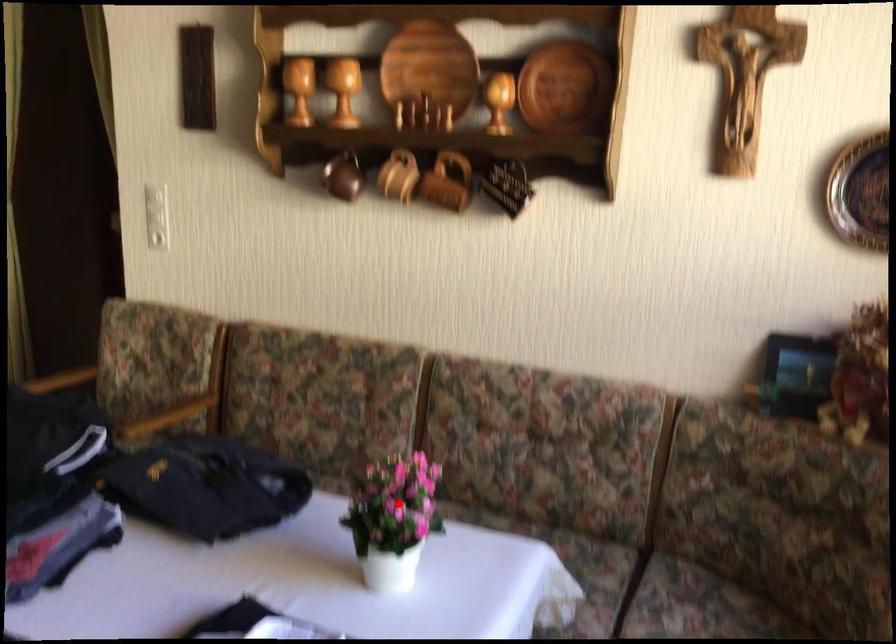
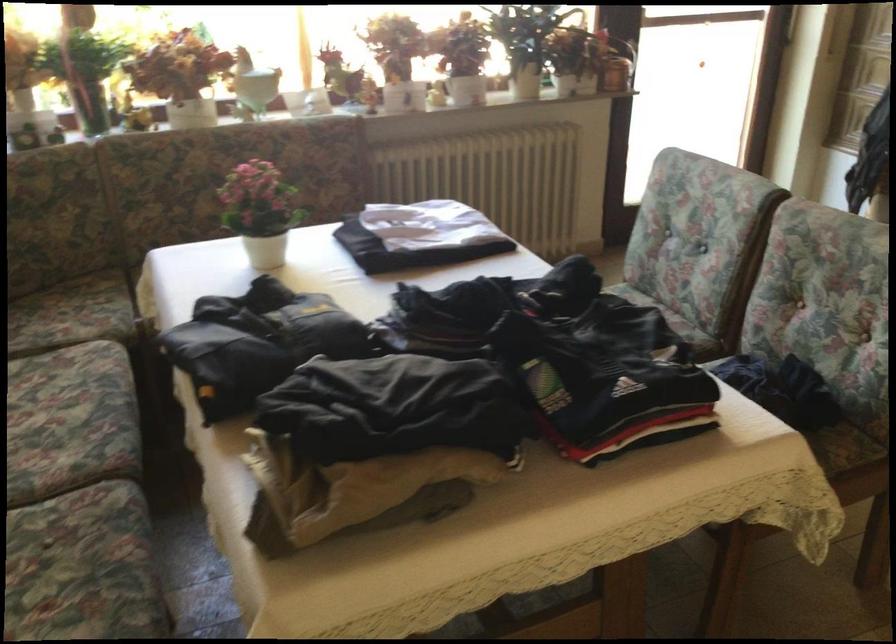
Question: I am providing you with two images of the same scene from different viewpoints. Image1 has a red point marked. In image2, the corresponding 3D location appears at what relative position? Reply with the corresponding letter.

Choices:
 (A) Closer
 (B) Farther

Answer: (B)